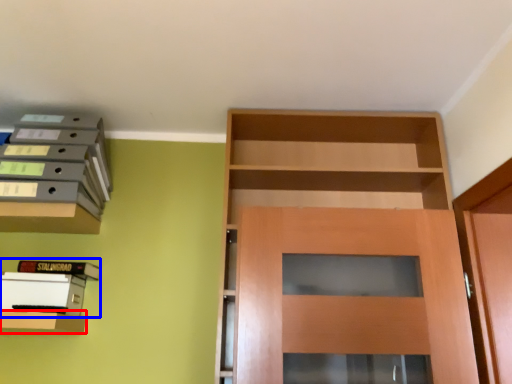
Question: Which object is further to the camera taking this photo, shelf (highlighted by a red box) or book (highlighted by a blue box)?

Choices:
 (A) shelf
 (B) book

Answer: (B)